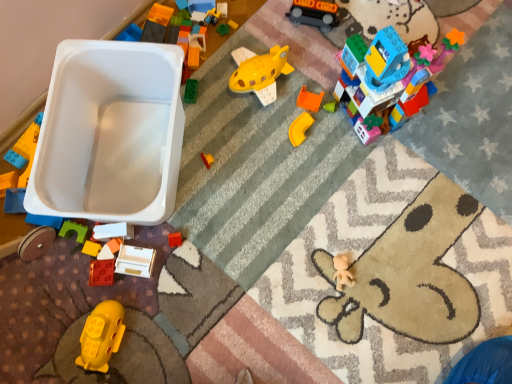
Identify the location of vacant space that is in between rubber brick at lower left, marked as the 2th toy in a left-to-right arrangement, and shiny black train at upper center, the eighth toy ordered from the bottom. (225, 132).